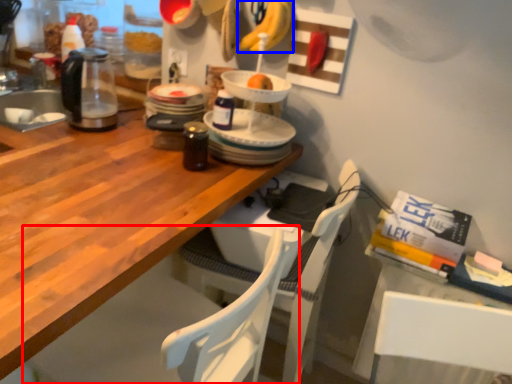
Question: Which of the following is the farthest to the observer, chair (highlighted by a red box) or banana (highlighted by a blue box)?

Choices:
 (A) chair
 (B) banana

Answer: (B)